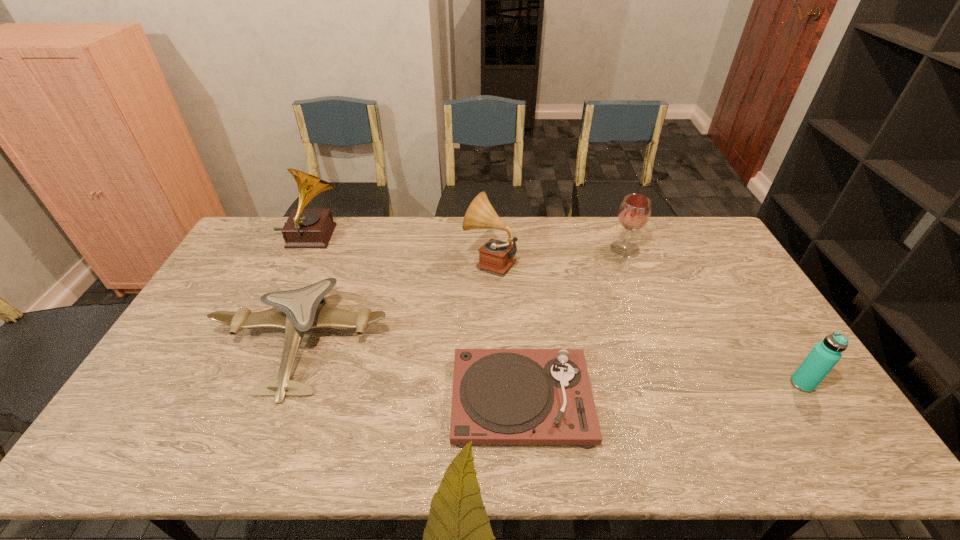
Where is `free space that satisfies the following two spatial constraints: 1. on the horn of the fifth shortest object; 2. on the right side of the nearest phonograph_record`? This screenshot has height=540, width=960. free space that satisfies the following two spatial constraints: 1. on the horn of the fifth shortest object; 2. on the right side of the nearest phonograph_record is located at coordinates (493, 399).

At what (x,y) coordinates should I click in order to perform the action: click on free space that satisfies the following two spatial constraints: 1. on the horn of the second shortest phonograph_record; 2. on the left side of the water bottle. Please return your answer as a coordinate pair (x, y). Looking at the image, I should click on (493, 384).

Locate an element on the screen. This screenshot has height=540, width=960. vacant space that satisfies the following two spatial constraints: 1. on the horn of the rightmost object; 2. on the right side of the second shortest phonograph_record is located at coordinates (493, 384).

The width and height of the screenshot is (960, 540). What are the coordinates of `vacant space that satisfies the following two spatial constraints: 1. on the back side of the nearest phonograph_record; 2. on the right side of the wineglass` in the screenshot? It's located at [x=510, y=249].

Find the location of a particular element. free location that satisfies the following two spatial constraints: 1. on the horn of the fifth shortest object; 2. on the back side of the water bottle is located at coordinates (493, 384).

The image size is (960, 540). Find the location of `free space that satisfies the following two spatial constraints: 1. from the horn of the fifth object from left to right; 2. on the left side of the leftmost phonograph_record`. free space that satisfies the following two spatial constraints: 1. from the horn of the fifth object from left to right; 2. on the left side of the leftmost phonograph_record is located at coordinates (305, 249).

At what (x,y) coordinates should I click in order to perform the action: click on vacant area that satisfies the following two spatial constraints: 1. on the back side of the wineglass; 2. on the right side of the nearest phonograph_record. Please return your answer as a coordinate pair (x, y). This screenshot has width=960, height=540. Looking at the image, I should click on (510, 249).

In order to click on free spot that satisfies the following two spatial constraints: 1. on the horn of the rightmost object; 2. on the left side of the fifth shortest object in this screenshot , I will do `click(493, 384)`.

You are a GUI agent. You are given a task and a screenshot of the screen. Output one action in this format:
    pyautogui.click(x=<x>, y=<y>)
    Task: Click on the free location that satisfies the following two spatial constraints: 1. from the horn of the leftmost phonograph_record; 2. on the back side of the fifth object from left to right
    The height and width of the screenshot is (540, 960).
    Given the screenshot: What is the action you would take?
    pyautogui.click(x=305, y=249)

Where is `vacant point that satisfies the following two spatial constraints: 1. from the horn of the leftmost phonograph_record; 2. on the back side of the second object from right to left`? The image size is (960, 540). vacant point that satisfies the following two spatial constraints: 1. from the horn of the leftmost phonograph_record; 2. on the back side of the second object from right to left is located at coordinates (305, 249).